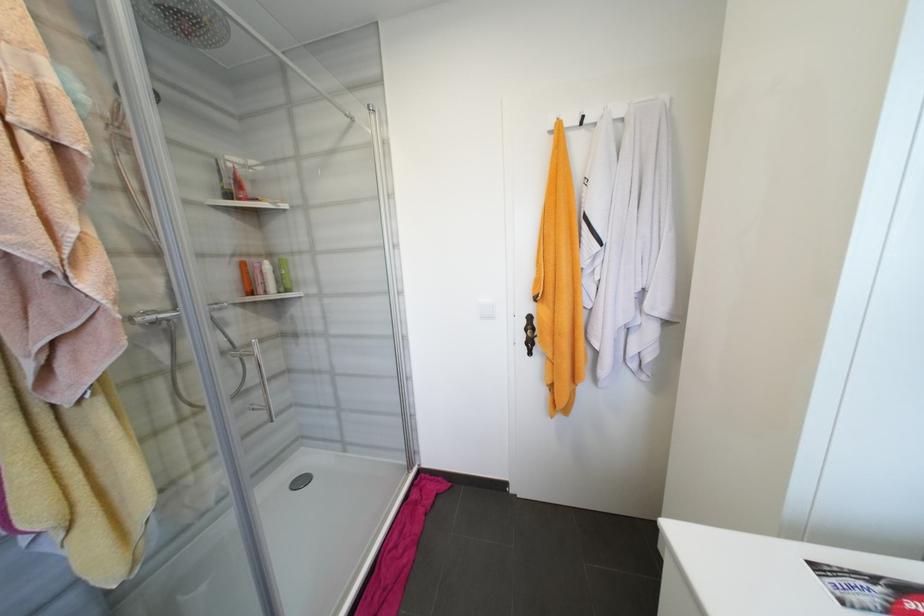
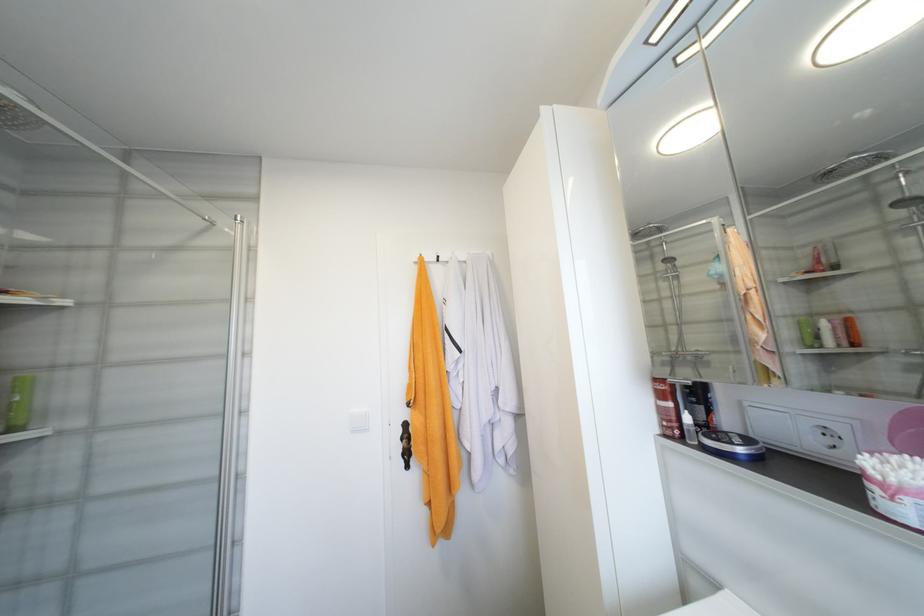
Where in the second image is the point corresponding to the point at 294,292 from the first image?

(19, 430)